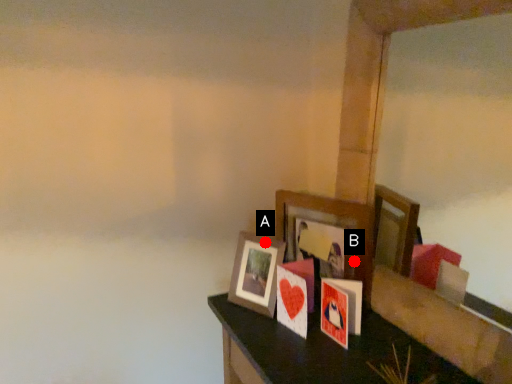
Question: Two points are circled on the image, labeled by A and B beside each circle. Which point is closer to the camera taking this photo?

Choices:
 (A) A is closer
 (B) B is closer

Answer: (B)